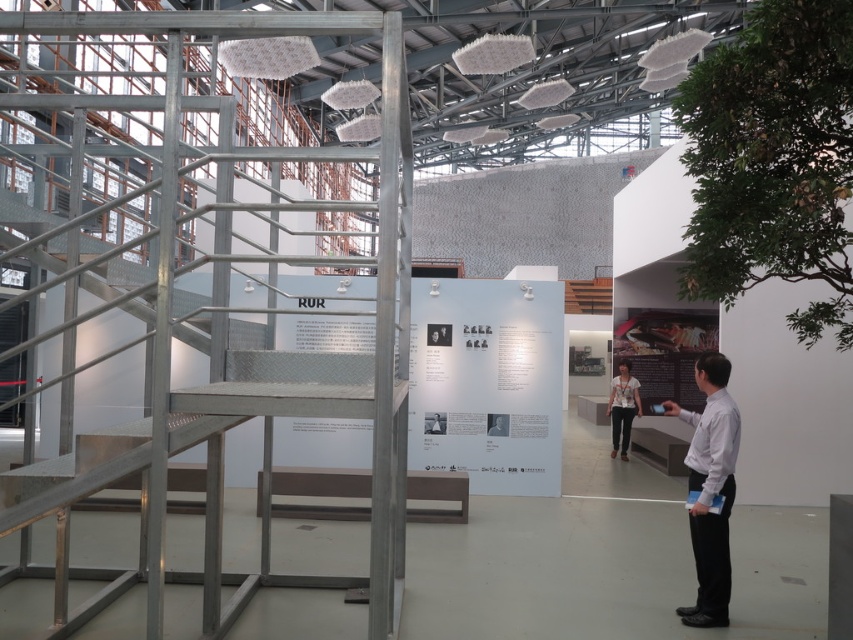
Question: Where is white shirt at right located in relation to white printed shirt at center in the image?

Choices:
 (A) right
 (B) left

Answer: (B)

Question: Which point is closer to the camera?

Choices:
 (A) 596,296
 (B) 614,451

Answer: (B)

Question: Among these objects, which one is nearest to the camera?

Choices:
 (A) white shirt at right
 (B) white printed shirt at center

Answer: (A)

Question: Does white printed shirt at center lie in front of wooden stairs at center?

Choices:
 (A) no
 (B) yes

Answer: (B)

Question: Which point is farther to the camera?

Choices:
 (A) wooden stairs at center
 (B) white printed shirt at center
 (C) white shirt at right

Answer: (A)

Question: Can you confirm if white shirt at right is smaller than white printed shirt at center?

Choices:
 (A) yes
 (B) no

Answer: (A)